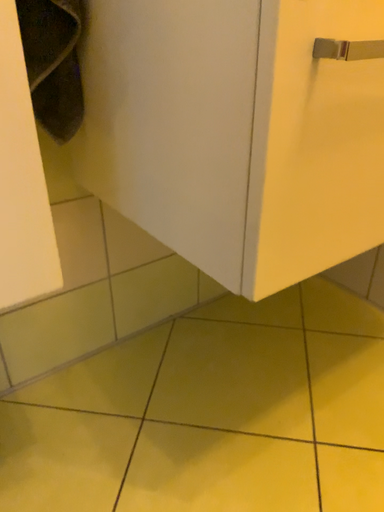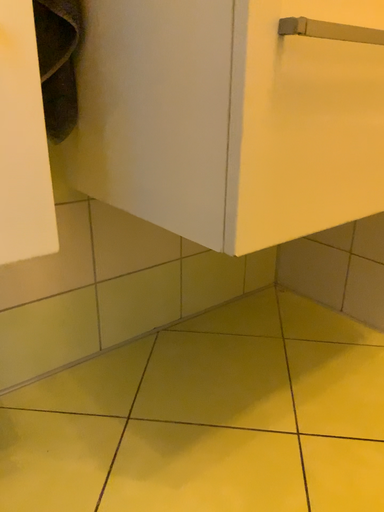
Question: How did the camera likely rotate when shooting the video?

Choices:
 (A) rotated downward
 (B) rotated upward

Answer: (B)